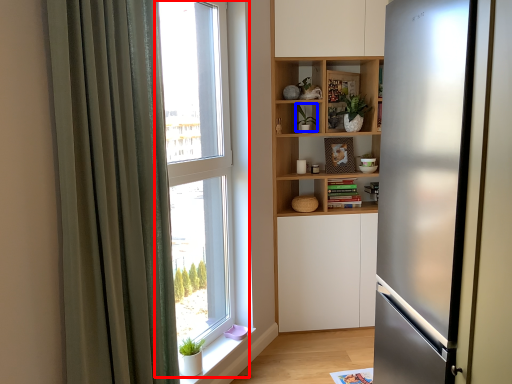
Question: Among these objects, which one is nearest to the camera, window (highlighted by a red box) or plant (highlighted by a blue box)?

Choices:
 (A) window
 (B) plant

Answer: (A)